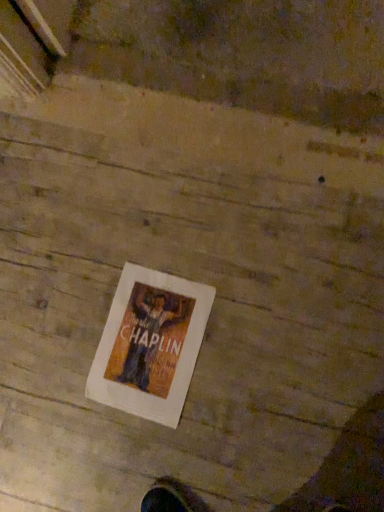
Find the location of `free space above white paper poster at center (from a real-world perspective)`. free space above white paper poster at center (from a real-world perspective) is located at coordinates (146, 348).